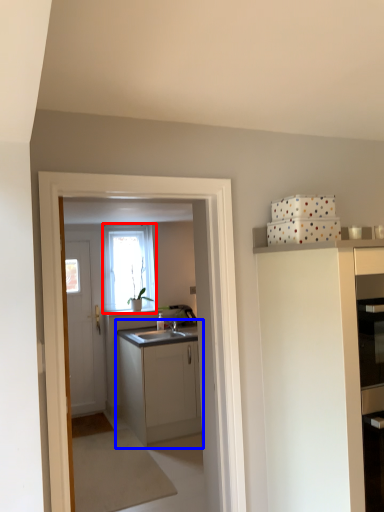
Question: Which object appears closest to the camera in this image, window (highlighted by a red box) or cabinetry (highlighted by a blue box)?

Choices:
 (A) window
 (B) cabinetry

Answer: (B)